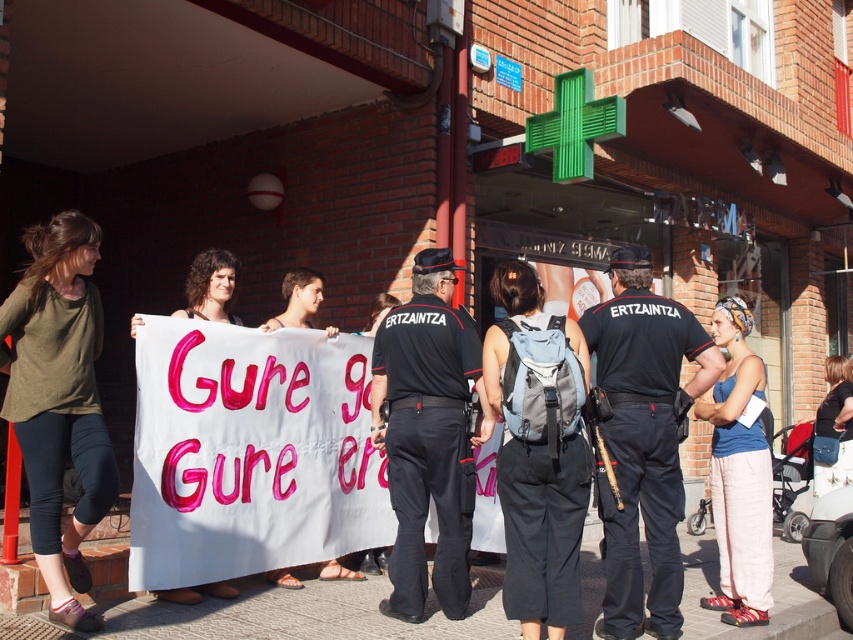
You are a photographer trying to capture a clear shot of both the green cotton shirt at center and the blue cotton tank top at center. If you want to ensure both are fully visible in your frame, which clothing item should you adjust your focus towards?

The green cotton shirt at center might be wider than the blue cotton tank top at center, so you should focus on the green cotton shirt at center to ensure both are fully visible.

You are a photographer trying to capture the protest scene. You notice two participants wearing a green cotton shirt at center and a blue cotton tank top at center. Which clothing item is visible on top?

The green cotton shirt at center is positioned over the blue cotton tank top at center, so the green cotton shirt at center is visible on top.

You are a photographer standing in front of the brick building and want to take a photo of the gray fabric backpack at center and the blue cotton tank top at center. Which object should you zoom in on to capture both in the frame without moving the camera?

The gray fabric backpack at center is smaller than the blue cotton tank top at center, so you should zoom in on the larger object, the blue cotton tank top at center, to include both in the frame without moving the camera.